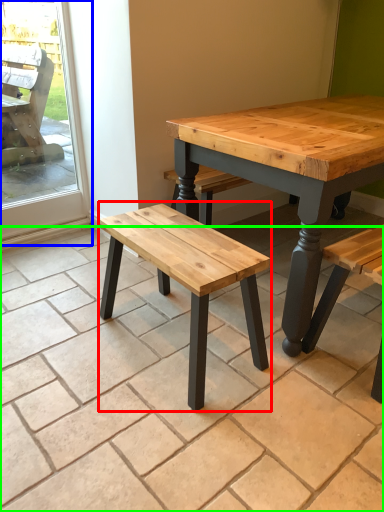
Question: Based on their relative distances, which object is farther from stool (highlighted by a red box)? Choose from screen door (highlighted by a blue box) and tile (highlighted by a green box).

Choices:
 (A) screen door
 (B) tile

Answer: (A)